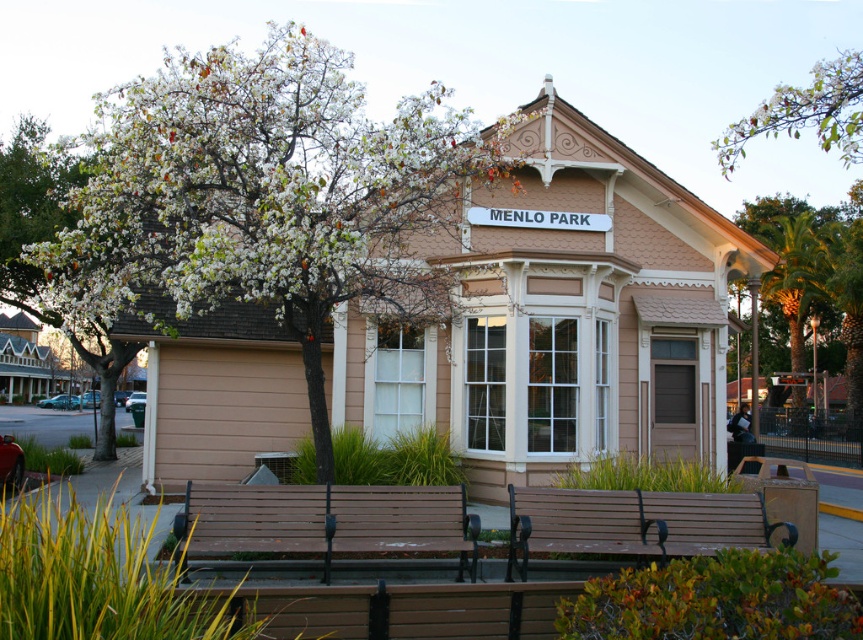
Can you confirm if white blossoms at left is bigger than green leafy palm at right?

Yes, white blossoms at left is bigger than green leafy palm at right.

Is white blossoms at left to the left of green leafy palm at right from the viewer's perspective?

Indeed, white blossoms at left is positioned on the left side of green leafy palm at right.

Describe the element at coordinates (49, 241) in the screenshot. I see `white blossoms at left` at that location.

I want to click on white blossoms at left, so click(x=49, y=241).

Consider the image. Is white blossoming tree at upper left to the left of brown wood bench at center from the viewer's perspective?

Correct, you'll find white blossoming tree at upper left to the left of brown wood bench at center.

Is point (287, 60) less distant than point (385, 547)?

That is False.

Image resolution: width=863 pixels, height=640 pixels. I want to click on white blossoming tree at upper left, so coord(268,198).

In the scene shown: Does white blossoming tree at upper left have a smaller size compared to brown wooden bench at lower center?

Actually, white blossoming tree at upper left might be larger than brown wooden bench at lower center.

Is white blossoming tree at upper left to the left of brown wooden bench at lower center from the viewer's perspective?

Indeed, white blossoming tree at upper left is positioned on the left side of brown wooden bench at lower center.

The width and height of the screenshot is (863, 640). I want to click on white blossoming tree at upper left, so click(x=268, y=198).